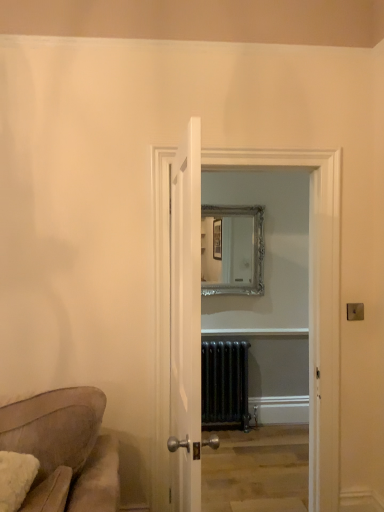
Question: Does clear glass door at center lie behind white wooden door at center?

Choices:
 (A) no
 (B) yes

Answer: (B)

Question: Is clear glass door at center positioned in front of white wooden door at center?

Choices:
 (A) no
 (B) yes

Answer: (A)

Question: From the image's perspective, is clear glass door at center beneath white wooden door at center?

Choices:
 (A) no
 (B) yes

Answer: (B)

Question: Considering the relative sizes of clear glass door at center and white wooden door at center in the image provided, is clear glass door at center wider than white wooden door at center?

Choices:
 (A) no
 (B) yes

Answer: (B)

Question: Does clear glass door at center have a lesser width compared to white wooden door at center?

Choices:
 (A) no
 (B) yes

Answer: (A)

Question: From a real-world perspective, is black metal radiator at center above or below silver/gilded mirror at center?

Choices:
 (A) below
 (B) above

Answer: (A)

Question: Relative to silver/gilded mirror at center, is black metal radiator at center in front or behind?

Choices:
 (A) front
 (B) behind

Answer: (A)

Question: Visually, is black metal radiator at center positioned to the left or to the right of silver/gilded mirror at center?

Choices:
 (A) left
 (B) right

Answer: (A)

Question: Considering the positions of black metal radiator at center and silver/gilded mirror at center in the image, is black metal radiator at center bigger or smaller than silver/gilded mirror at center?

Choices:
 (A) big
 (B) small

Answer: (B)

Question: Would you say clear glass door at center is to the left or to the right of metallic gold light switch at upper right in the picture?

Choices:
 (A) right
 (B) left

Answer: (B)

Question: Looking at their shapes, would you say clear glass door at center is wider or thinner than metallic gold light switch at upper right?

Choices:
 (A) wide
 (B) thin

Answer: (A)

Question: In terms of size, does clear glass door at center appear bigger or smaller than metallic gold light switch at upper right?

Choices:
 (A) small
 (B) big

Answer: (B)

Question: Is point (339, 322) closer or farther from the camera than point (350, 315)?

Choices:
 (A) farther
 (B) closer

Answer: (B)

Question: From the image's perspective, is silver/gilded mirror at center positioned above or below black metal radiator at center?

Choices:
 (A) below
 (B) above

Answer: (B)

Question: Is point (233, 228) closer or farther from the camera than point (218, 373)?

Choices:
 (A) farther
 (B) closer

Answer: (A)